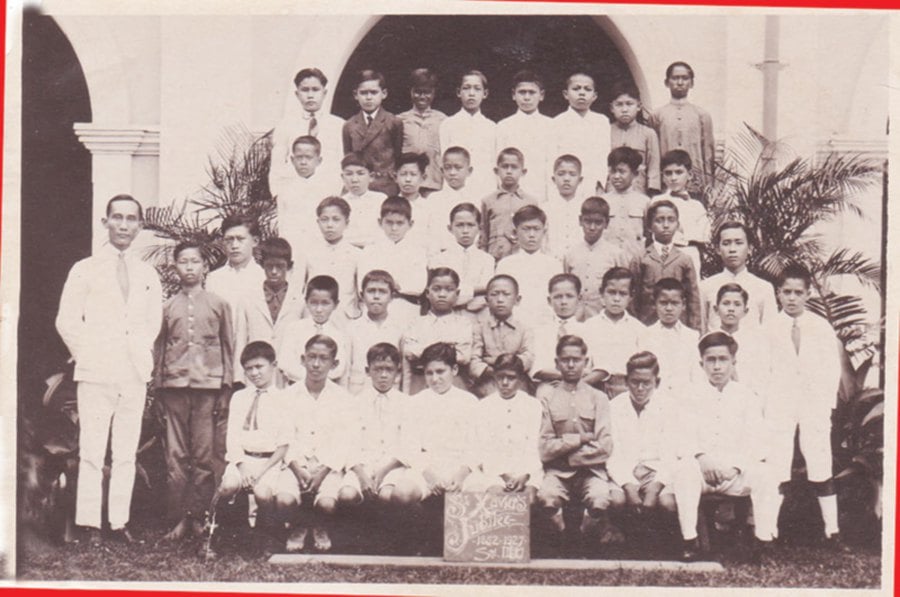
You are a GUI agent. You are given a task and a screenshot of the screen. Output one action in this format:
    pyautogui.click(x=<x>, y=<y>)
    Task: Click on the archway
    Image resolution: width=900 pixels, height=597 pixels.
    Given the screenshot: What is the action you would take?
    pyautogui.click(x=623, y=38)